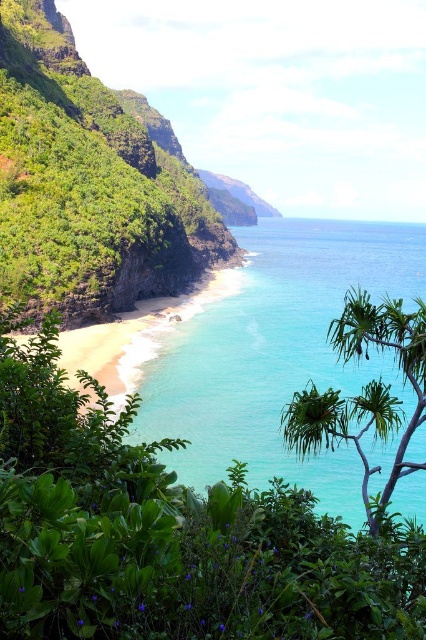
Question: Which object is positioned farthest from the green leafy hillside at left?

Choices:
 (A) green leafy shrubs at center
 (B) turquoise clear water at center
 (C) green leafy tree at center

Answer: (A)

Question: Does turquoise clear water at center appear over green leafy tree at center?

Choices:
 (A) yes
 (B) no

Answer: (A)

Question: Which of the following is the closest to the observer?

Choices:
 (A) (256, 588)
 (B) (350, 328)
 (C) (135, 420)
 (D) (57, 205)

Answer: (A)

Question: Is green leafy shrubs at center positioned in front of green leafy hillside at left?

Choices:
 (A) yes
 (B) no

Answer: (A)

Question: Is turquoise clear water at center above green leafy tree at center?

Choices:
 (A) no
 (B) yes

Answer: (B)

Question: Which point is closer to the camera?

Choices:
 (A) (411, 294)
 (B) (28, 184)
 (C) (399, 618)
 (D) (310, 396)

Answer: (C)